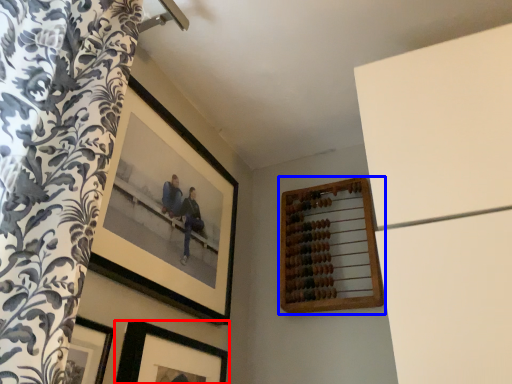
Question: Which object appears farthest to the camera in this image, picture frame (highlighted by a red box) or picture frame (highlighted by a blue box)?

Choices:
 (A) picture frame
 (B) picture frame

Answer: (B)